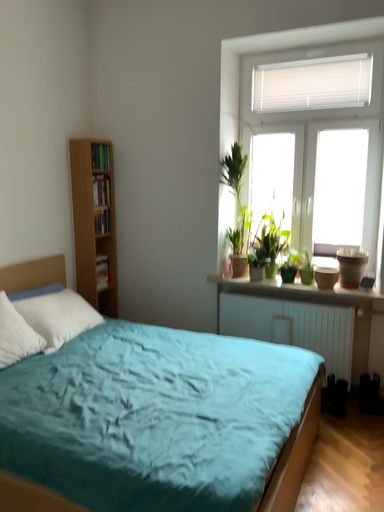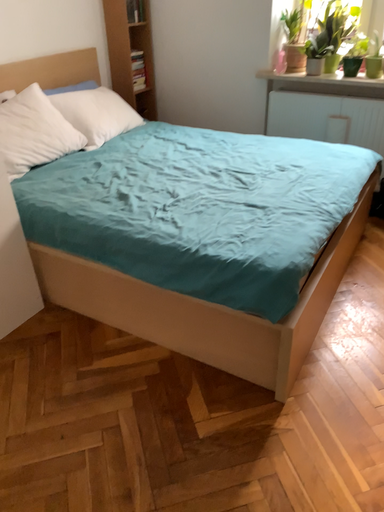
Question: How did the camera likely rotate when shooting the video?

Choices:
 (A) rotated downward
 (B) rotated upward

Answer: (A)